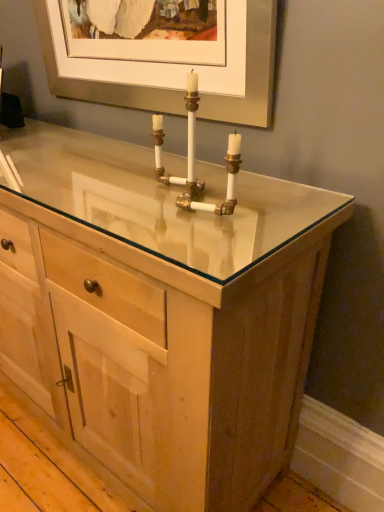
Identify the location of free area below white brass pipe at center (from a real-world perspective). The height and width of the screenshot is (512, 384). (180, 202).